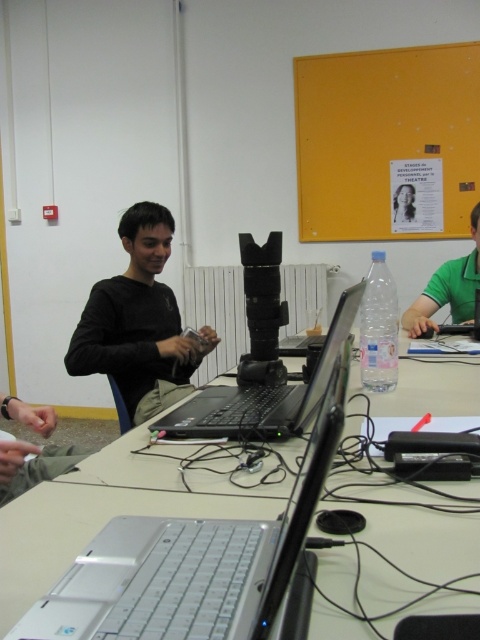
Who is positioned more to the left, black matte laptop at center or black plastic laptop at center?

black matte laptop at center

Consider the image. Can you confirm if black matte laptop at center is bigger than black plastic laptop at center?

Yes, black matte laptop at center is bigger than black plastic laptop at center.

I want to click on black matte laptop at center, so click(264, 394).

Which is more to the right, black matte shirt at center or black matte laptop at center?

black matte laptop at center

Does black matte shirt at center have a lesser width compared to black matte laptop at center?

No.

Where is `black matte shirt at center`? This screenshot has width=480, height=640. black matte shirt at center is located at coordinates (139, 323).

I want to click on black matte shirt at center, so click(139, 323).

Can you confirm if yellow matte bulletin board at upper right is thinner than white plastic table at center?

No, yellow matte bulletin board at upper right is not thinner than white plastic table at center.

Does yellow matte bulletin board at upper right have a greater width compared to white plastic table at center?

Yes.

What do you see at coordinates (384, 136) in the screenshot?
I see `yellow matte bulletin board at upper right` at bounding box center [384, 136].

Locate an element on the screen. The width and height of the screenshot is (480, 640). yellow matte bulletin board at upper right is located at coordinates [384, 136].